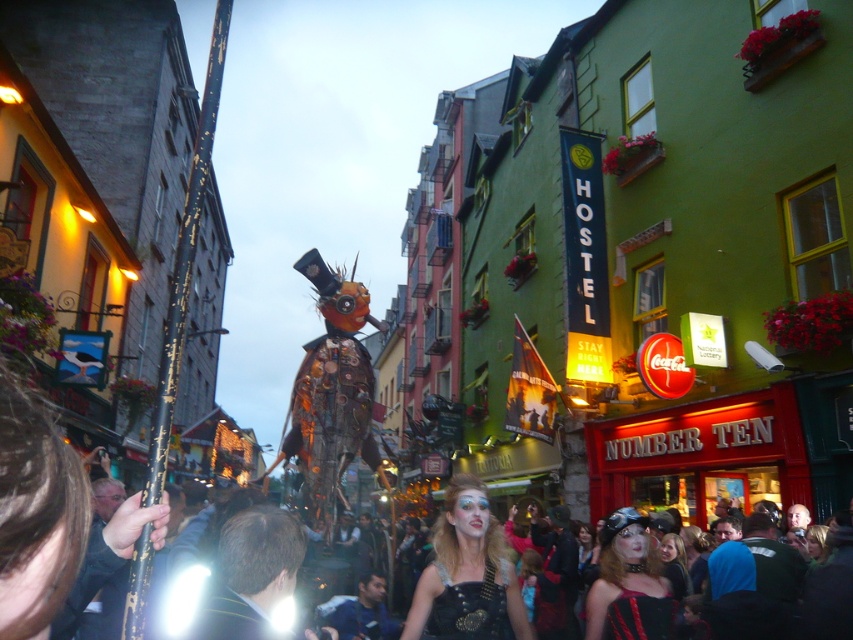
You are a photographer standing at the camera position. You want to capture a closeup shot of the shiny black leather dress at center. Given that your camera can focus on objects within 25 meters, will you be able to take the closeup without moving closer?

The shiny black leather dress at center is 27.02 meters from the camera, which is beyond the camera focus range of 25 meters. Therefore, you won not be able to take the closeup without moving closer.

From the picture: You are standing in the middle of the street looking at the festive scene. There are two points marked in the image. The first point is at coordinate (611, 545) and the second is at (490, 612). Which point is closer to you?

Point (611, 545) is closer to you because it is further to the viewer than point (490, 612).